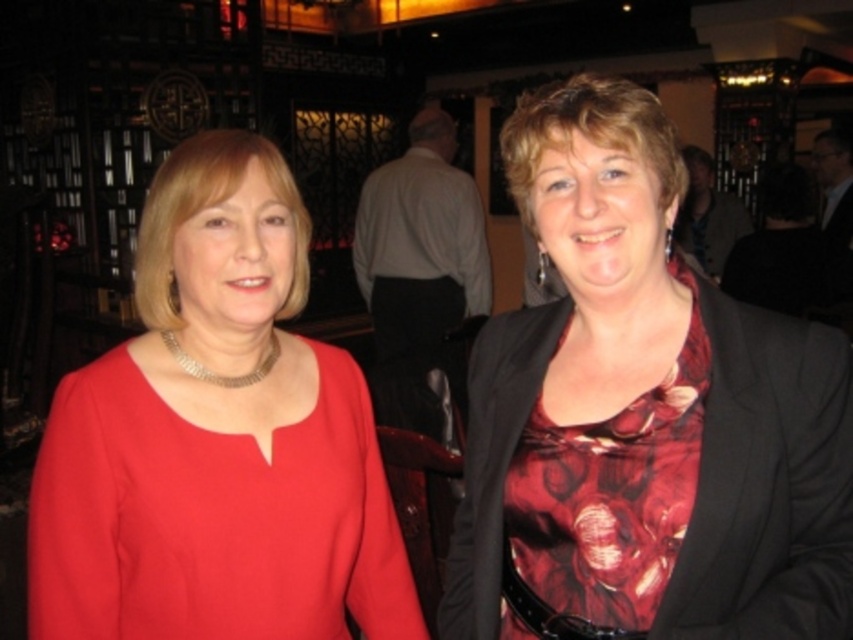
You are a photographer at a social event and need to capture a portrait of both the floral silk blouse at center and the floral satin dress at center. Since the camera can only focus on one subject at a time, which item should you focus on to ensure it appears larger in the photo?

The floral silk blouse at center should be focused on because it has a greater height compared to the floral satin dress at center, making it naturally larger in the photo.

You are a photographer at a social event and need to capture a closeup shot of the matte gold necklace at center and the floral satin dress at center. Which object should you focus on first if you want to ensure both are in frame without moving the camera?

You should focus on the matte gold necklace at center first because its width is larger than the floral satin dress at center, so capturing it first ensures both will fit within the frame.